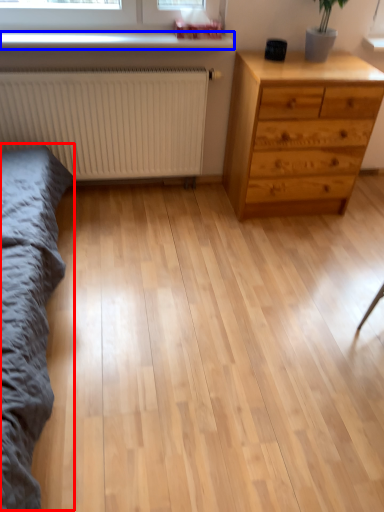
Question: Among these objects, which one is nearest to the camera, bed frame (highlighted by a red box) or window sill (highlighted by a blue box)?

Choices:
 (A) bed frame
 (B) window sill

Answer: (A)